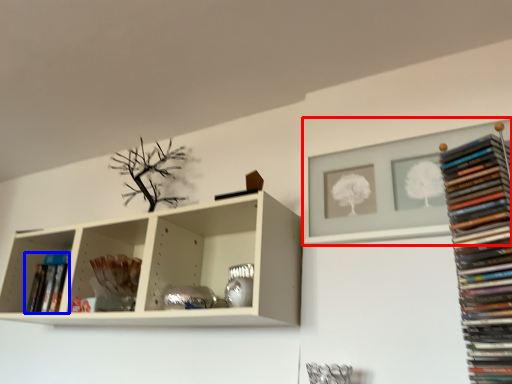
Question: Which object appears closest to the camera in this image, shelf (highlighted by a red box) or book (highlighted by a blue box)?

Choices:
 (A) shelf
 (B) book

Answer: (A)